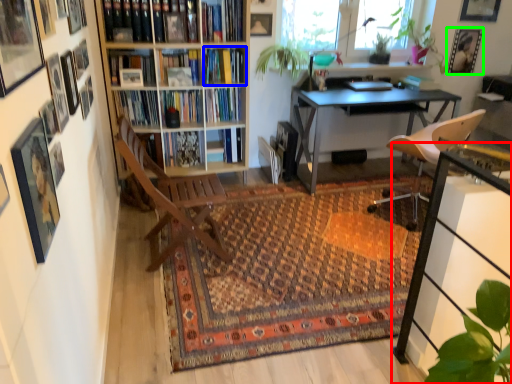
Question: Which is farther away from table (highlighted by a red box)? book (highlighted by a blue box) or picture frame (highlighted by a green box)?

Choices:
 (A) book
 (B) picture frame

Answer: (B)